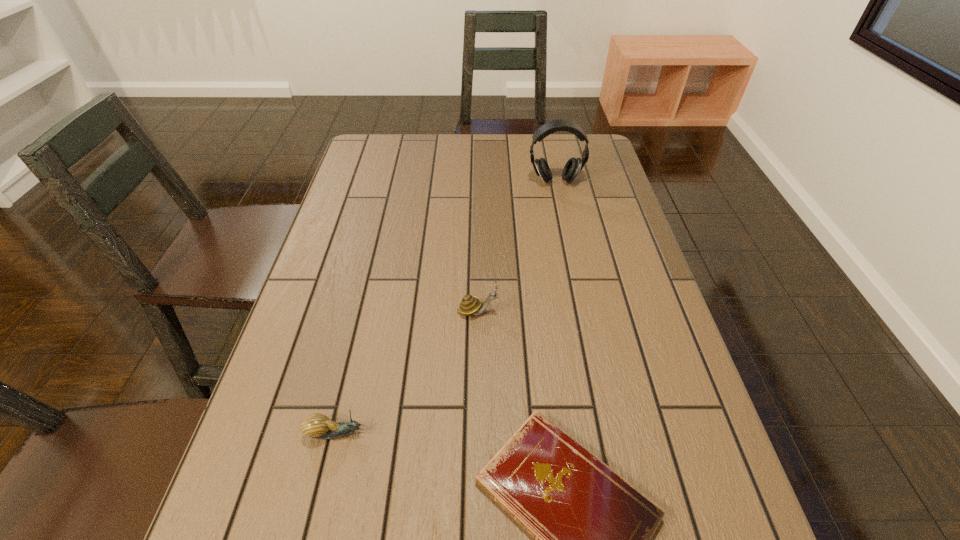
Where is `the tallest object`? the tallest object is located at coordinates (573, 167).

The width and height of the screenshot is (960, 540). What are the coordinates of `earphone` in the screenshot? It's located at (573, 167).

Image resolution: width=960 pixels, height=540 pixels. In order to click on the taller escargot in this screenshot , I will do `click(470, 305)`.

What are the coordinates of `the second tallest object` in the screenshot? It's located at (470, 305).

Where is `the second shortest object`? the second shortest object is located at coordinates (318, 426).

Find the location of a particular element. the nearer escargot is located at coordinates (318, 426).

At what (x,y) coordinates should I click in order to perform the action: click on free spot located on the ear cups of the earphone. Please return your answer as a coordinate pair (x, y). This screenshot has height=540, width=960. Looking at the image, I should click on (566, 235).

I want to click on free space located on the face of the taller escargot, so click(585, 311).

I want to click on vacant space situated on the front-facing side of the second shortest object, so click(x=416, y=433).

At what (x,y) coordinates should I click in order to perform the action: click on object that is at the left edge. Please return your answer as a coordinate pair (x, y). The width and height of the screenshot is (960, 540). Looking at the image, I should click on (318, 426).